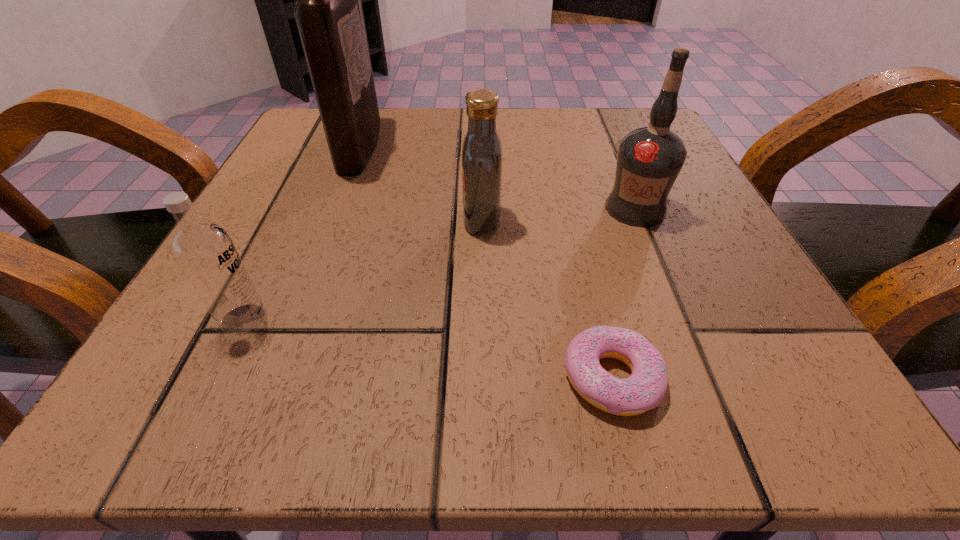
Identify the location of object that is the closest to the fourth farthest object. (482, 156).

I want to click on vodka that is the third nearest to the farthest object, so click(649, 159).

Choose which vodka is the second nearest neighbor to the second vodka from left to right. Please provide its 2D coordinates. Your answer should be formatted as a tuple, i.e. [(x, y)], where the tuple contains the x and y coordinates of a point satisfying the conditions above.

[(205, 252)]

What are the coordinates of `vacant position in the image that satisfies the following two spatial constraints: 1. on the front-facing side of the second vodka from right to left; 2. on the left side of the doughnut` in the screenshot? It's located at (483, 378).

You are a GUI agent. You are given a task and a screenshot of the screen. Output one action in this format:
    pyautogui.click(x=<x>, y=<y>)
    Task: Click on the free location that satisfies the following two spatial constraints: 1. on the label side of the liquor; 2. on the right side of the shortest object
    This screenshot has width=960, height=540.
    Given the screenshot: What is the action you would take?
    pyautogui.click(x=270, y=378)

You are a GUI agent. You are given a task and a screenshot of the screen. Output one action in this format:
    pyautogui.click(x=<x>, y=<y>)
    Task: Click on the vacant point that satisfies the following two spatial constraints: 1. on the front label of the rightmost object; 2. on the front-facing side of the second vodka from left to right
    This screenshot has height=540, width=960.
    Given the screenshot: What is the action you would take?
    pyautogui.click(x=639, y=219)

What are the coordinates of `free space that satisfies the following two spatial constraints: 1. on the label side of the liquor; 2. on the back side of the nearest object` in the screenshot? It's located at 270,378.

At what (x,y) coordinates should I click in order to perform the action: click on vacant region that satisfies the following two spatial constraints: 1. on the front label of the nearest vodka; 2. on the right side of the doughnut. Please return your answer as a coordinate pair (x, y). The width and height of the screenshot is (960, 540). Looking at the image, I should click on (215, 378).

This screenshot has width=960, height=540. I want to click on vacant region that satisfies the following two spatial constraints: 1. on the front label of the rightmost vodka; 2. on the front-facing side of the second vodka from right to left, so click(x=639, y=219).